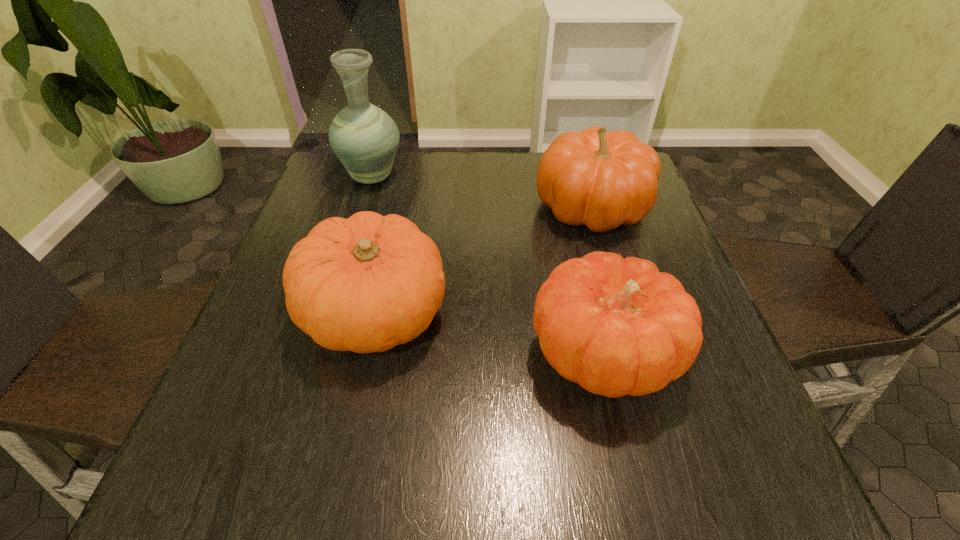
Where is `pitcher`? The image size is (960, 540). pitcher is located at coordinates (365, 138).

You are a GUI agent. You are given a task and a screenshot of the screen. Output one action in this format:
    pyautogui.click(x=<x>, y=<y>)
    Task: Click on the farthest pumpkin
    The width and height of the screenshot is (960, 540).
    Given the screenshot: What is the action you would take?
    pyautogui.click(x=600, y=179)

This screenshot has width=960, height=540. Find the location of `the leftmost pumpkin`. the leftmost pumpkin is located at coordinates (365, 284).

Locate an element on the screen. Image resolution: width=960 pixels, height=540 pixels. vacant space situated on the back of the farthest pumpkin is located at coordinates (578, 165).

Where is `free space located on the right of the leftmost pumpkin`? This screenshot has height=540, width=960. free space located on the right of the leftmost pumpkin is located at coordinates (578, 314).

At what (x,y) coordinates should I click in order to perform the action: click on pitcher that is at the far edge. Please return your answer as a coordinate pair (x, y). The width and height of the screenshot is (960, 540). Looking at the image, I should click on (365, 138).

I want to click on pumpkin at the far edge, so click(x=600, y=179).

Identify the location of pitcher that is at the left edge. This screenshot has height=540, width=960. (365, 138).

Locate an element on the screen. Image resolution: width=960 pixels, height=540 pixels. pumpkin present at the left edge is located at coordinates (365, 284).

Image resolution: width=960 pixels, height=540 pixels. In order to click on object present at the far left corner in this screenshot , I will do click(x=365, y=138).